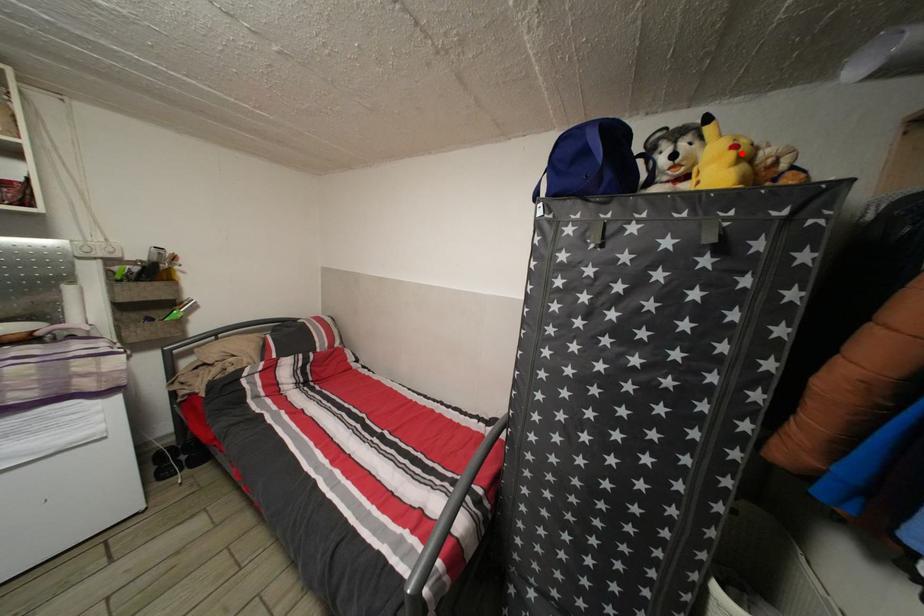
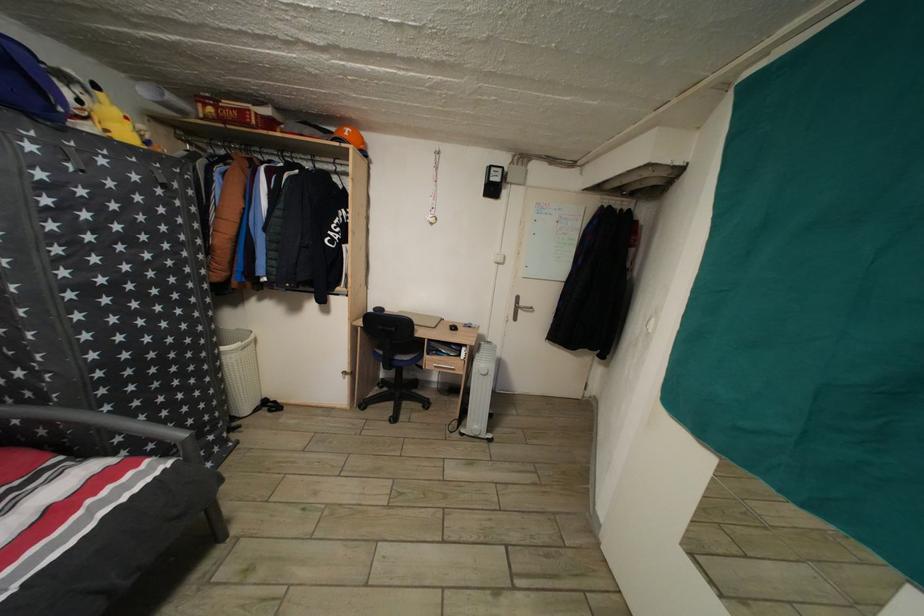
Find the pixel in the second image that matches the highlighted location in the first image.

(134, 124)